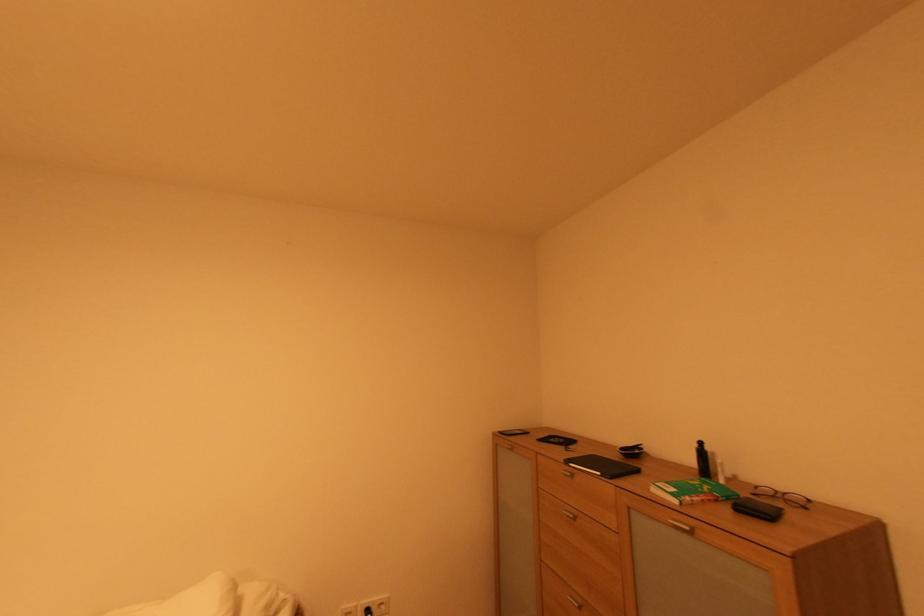
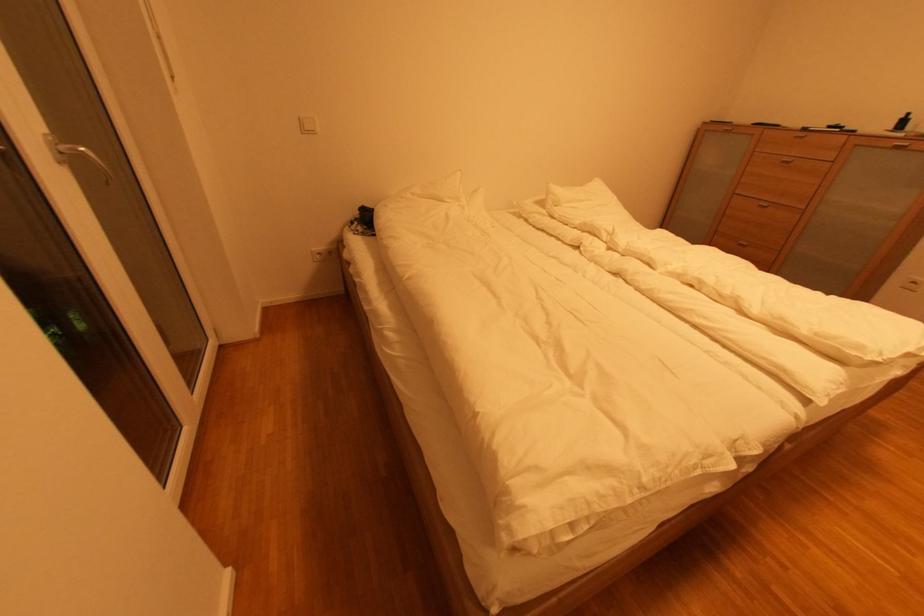
The point at (701, 447) is marked in the first image. Where is the corresponding point in the second image?

(908, 118)